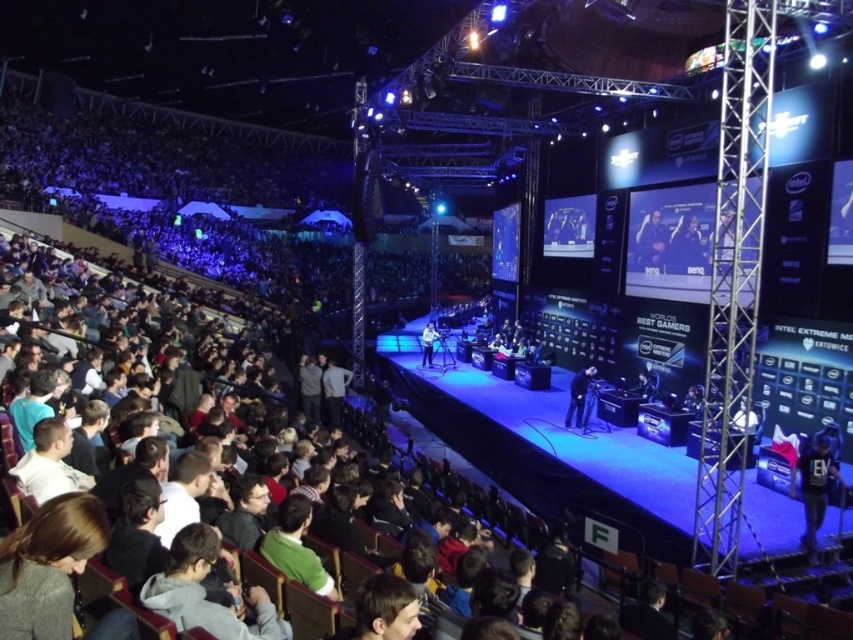
You are a photographer at the event. You want to capture a photo of the smooth skin face at upper center and the dark blue leather jacket at center. Which object should you focus on first if you want to ensure both are in focus without adjusting the camera settings?

The smooth skin face at upper center is shorter than the dark blue leather jacket at center, so you should focus on the dark blue leather jacket at center first since it is farther away. This way, the depth of field will cover both objects more effectively.

You are a photographer at the gaming event. You need to capture a photo that includes both the smooth skin face at upper center and the dark blue leather jacket at center. Which object should you focus on first to ensure both are in frame?

The smooth skin face at upper center is located below the dark blue leather jacket at center, so you should focus on the dark blue leather jacket at center first to ensure both are in frame.

You are a photographer standing at the back of the arena. You want to take a photo of the smooth skin face at upper center and the dark blue leather jacket at center so that both are clearly visible. Given that your camera can focus on objects within a 30 inch range, will you be able to capture both subjects in focus?

The smooth skin face at upper center is 32.04 inches away from the dark blue leather jacket at center. Since the camera can only focus within a 30 inch range, the distance between them exceeds the camera capabilities, so both subjects cannot be in focus simultaneously.